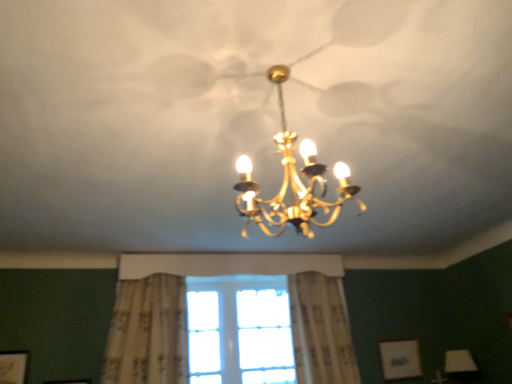
Question: Considering the relative sizes of gold metallic chandelier at center and clear glass window at center in the image provided, is gold metallic chandelier at center smaller than clear glass window at center?

Choices:
 (A) no
 (B) yes

Answer: (B)

Question: Does gold metallic chandelier at center appear on the right side of clear glass window at center?

Choices:
 (A) yes
 (B) no

Answer: (A)

Question: From a real-world perspective, is gold metallic chandelier at center physically above clear glass window at center?

Choices:
 (A) no
 (B) yes

Answer: (B)

Question: Is clear glass window at center at the back of gold metallic chandelier at center?

Choices:
 (A) no
 (B) yes

Answer: (A)

Question: Is clear glass window at center located within gold metallic chandelier at center?

Choices:
 (A) yes
 (B) no

Answer: (B)

Question: Does gold metallic chandelier at center have a lesser width compared to clear glass window at center?

Choices:
 (A) no
 (B) yes

Answer: (A)

Question: Can you confirm if white textured curtain at center, acting as the second curtain starting from the left, is wider than clear glass window at center?

Choices:
 (A) no
 (B) yes

Answer: (B)

Question: Can you confirm if white textured curtain at center, acting as the second curtain starting from the left, is shorter than clear glass window at center?

Choices:
 (A) yes
 (B) no

Answer: (B)

Question: Is white textured curtain at center, acting as the second curtain starting from the left, facing away from clear glass window at center?

Choices:
 (A) yes
 (B) no

Answer: (B)

Question: From a real-world perspective, is white textured curtain at center, the 1th curtain viewed from the right, beneath clear glass window at center?

Choices:
 (A) no
 (B) yes

Answer: (A)

Question: From the image's perspective, is white textured curtain at center, the 1th curtain viewed from the right, over clear glass window at center?

Choices:
 (A) yes
 (B) no

Answer: (A)

Question: Can you confirm if white textured curtain at center, the 1th curtain viewed from the right, is smaller than clear glass window at center?

Choices:
 (A) yes
 (B) no

Answer: (B)

Question: Considering the relative sizes of matte white picture frame at lower left, the second picture frame positioned from the back, and gold metallic chandelier at center in the image provided, is matte white picture frame at lower left, the second picture frame positioned from the back, thinner than gold metallic chandelier at center?

Choices:
 (A) yes
 (B) no

Answer: (A)